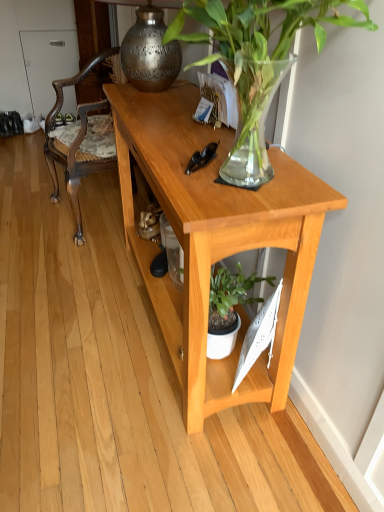
Identify the location of vacant area that is in front of light wood desk at center. This screenshot has height=512, width=384. (136, 430).